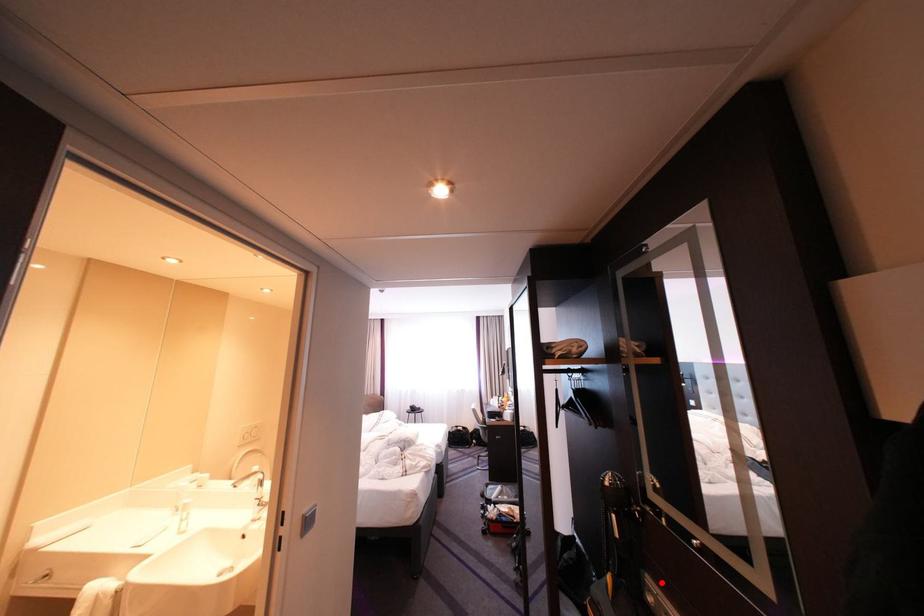
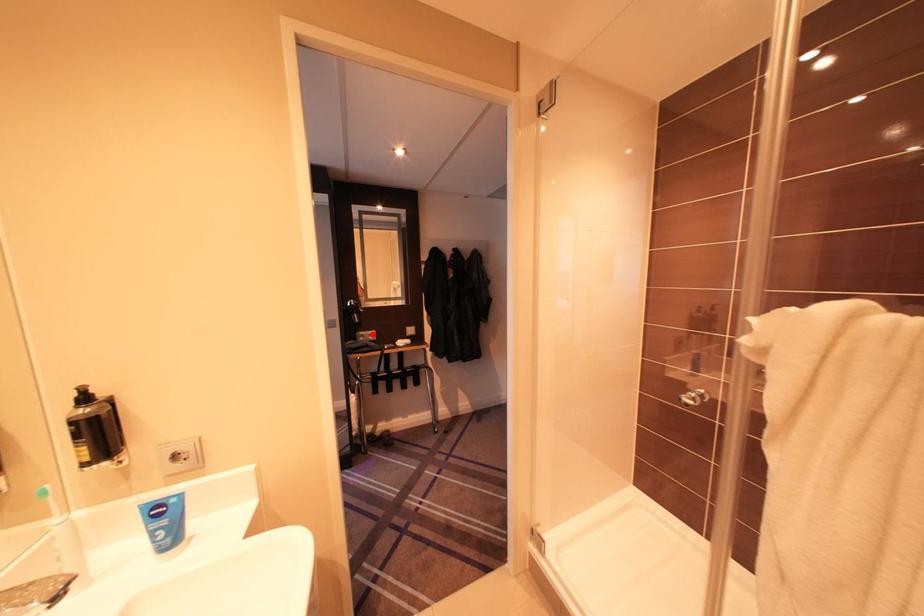
I am providing you with two images of the same scene from different viewpoints. A red point is marked on the first image and another point is marked on the second image. Are the points marked in image1 and image2 representing the same 3D position?

Yes